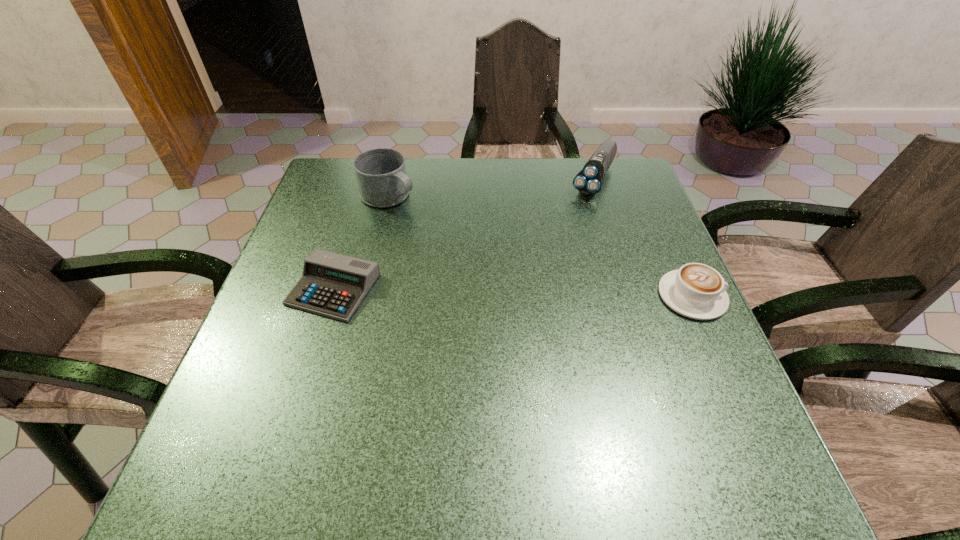
Locate an element on the screen. This screenshot has height=540, width=960. calculator is located at coordinates (333, 285).

The image size is (960, 540). What are the coordinates of `cappuccino` in the screenshot? It's located at (697, 291).

Locate an element on the screen. This screenshot has height=540, width=960. mug is located at coordinates (381, 174).

This screenshot has height=540, width=960. What are the coordinates of `the third shortest object` in the screenshot? It's located at [588, 181].

Locate an element on the screen. This screenshot has width=960, height=540. vacant region located on the front of the calculator is located at coordinates (299, 402).

This screenshot has height=540, width=960. What are the coordinates of `vacant space situated 0.280m on the side of the mug with the handle` in the screenshot? It's located at (486, 255).

Identify the location of vacant space situated 0.080m on the side of the mug with the handle. The image size is (960, 540). (429, 220).

Where is `blank space located on the side of the mug with the handle`? This screenshot has height=540, width=960. blank space located on the side of the mug with the handle is located at coordinates (480, 251).

At what (x,y) coordinates should I click in order to perform the action: click on vacant space located on the head of the third shortest object. Please return your answer as a coordinate pair (x, y). Looking at the image, I should click on (552, 256).

This screenshot has height=540, width=960. Identify the location of vacant space located on the head of the third shortest object. (581, 209).